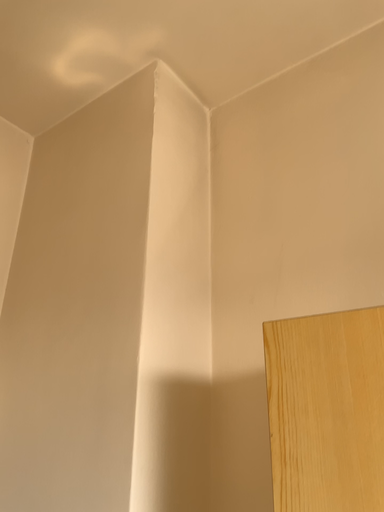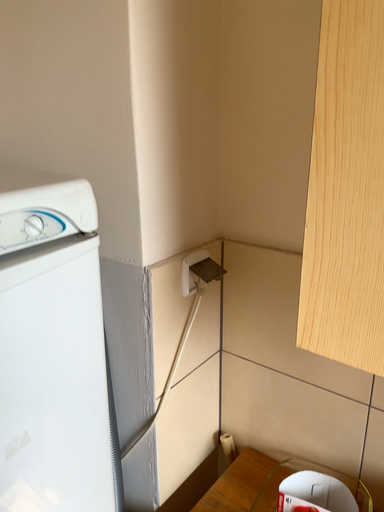
Question: Which way did the camera rotate in the video?

Choices:
 (A) rotated upward
 (B) rotated downward

Answer: (B)